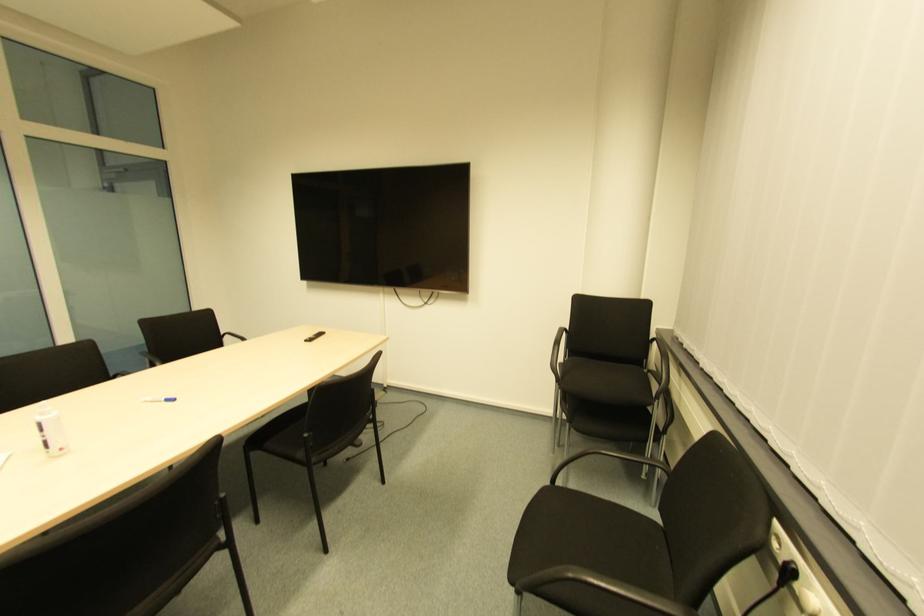
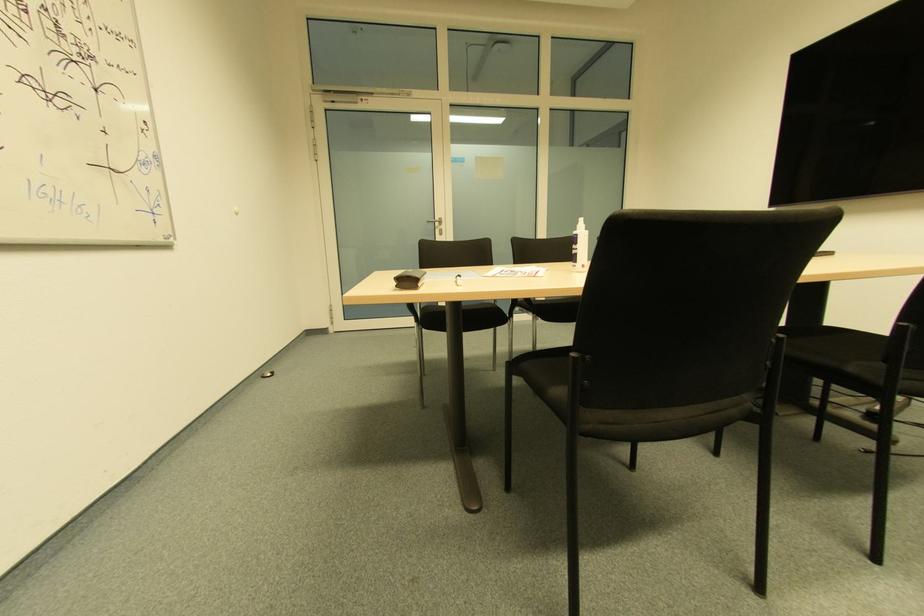
Question: The first image is from the beginning of the video and the second image is from the end. How did the camera likely rotate when shooting the video?

Choices:
 (A) Left
 (B) Right
 (C) Up
 (D) Down

Answer: (A)